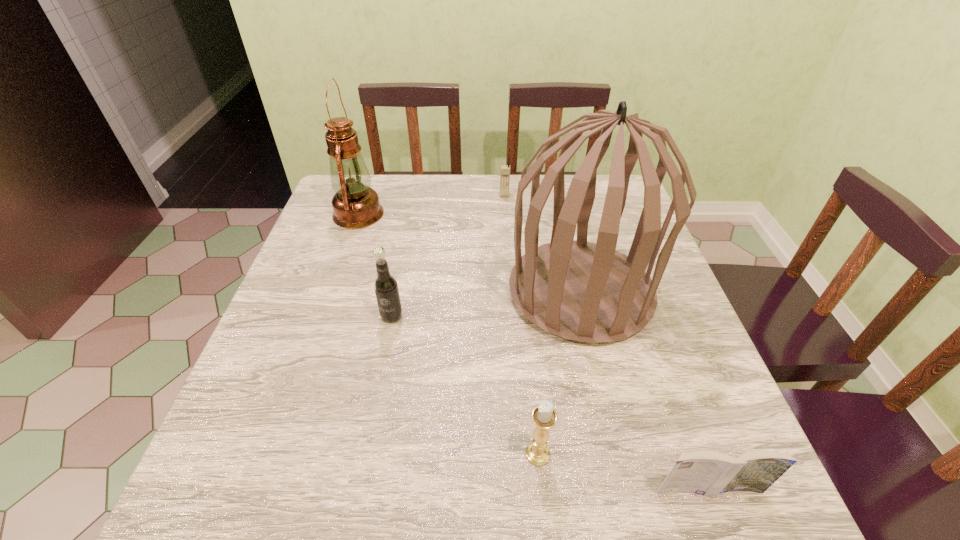
Locate an element on the screen. Image resolution: width=960 pixels, height=540 pixels. book at the right edge is located at coordinates (708, 473).

Where is `object that is at the far left corner`? object that is at the far left corner is located at coordinates (355, 205).

This screenshot has height=540, width=960. Find the location of `object situated at the near right corner`. object situated at the near right corner is located at coordinates (708, 473).

Where is `vacant region at the far edge of the desktop`? This screenshot has width=960, height=540. vacant region at the far edge of the desktop is located at coordinates (428, 174).

This screenshot has height=540, width=960. I want to click on blank space at the near edge of the desktop, so click(500, 465).

What are the coordinates of `free space at the left edge of the desktop` in the screenshot? It's located at (298, 367).

In the image, there is a desktop. Where is `vacant space at the right edge`? The image size is (960, 540). vacant space at the right edge is located at coordinates (669, 443).

In the image, there is a desktop. Where is `free space at the near left corner`? Image resolution: width=960 pixels, height=540 pixels. free space at the near left corner is located at coordinates (206, 519).

What are the coordinates of `vacant region at the far right corner` in the screenshot? It's located at (599, 187).

In the image, there is a desktop. Where is `vacant space at the near right corner`? vacant space at the near right corner is located at coordinates (659, 478).